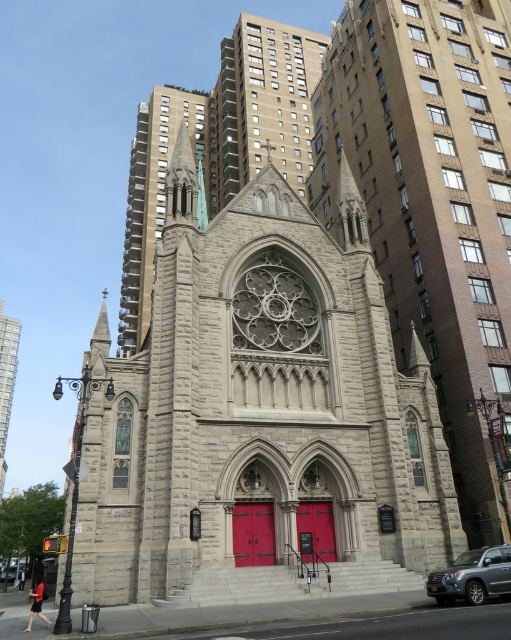
Question: Which of the following is the farthest from the observer?

Choices:
 (A) (470, 573)
 (B) (259, 504)
 (C) (133, 346)

Answer: (C)

Question: Can you confirm if gray stone spire at center is positioned to the right of smooth red door at center?

Choices:
 (A) yes
 (B) no

Answer: (B)

Question: Which point is farther to the camera?

Choices:
 (A) (13, 577)
 (B) (252, 515)
 (C) (482, 592)

Answer: (A)

Question: Estimate the real-world distances between objects in this image. Which object is farther from the matte red door at center?

Choices:
 (A) gray stone tower at center
 (B) smooth red door at center
 (C) silver metallic car at lower left

Answer: (C)

Question: Can you confirm if gray stone tower at center is smaller than gray stone tower at upper center?

Choices:
 (A) yes
 (B) no

Answer: (A)

Question: Is gray stone tower at upper center to the left of silver metallic car at lower left from the viewer's perspective?

Choices:
 (A) no
 (B) yes

Answer: (A)